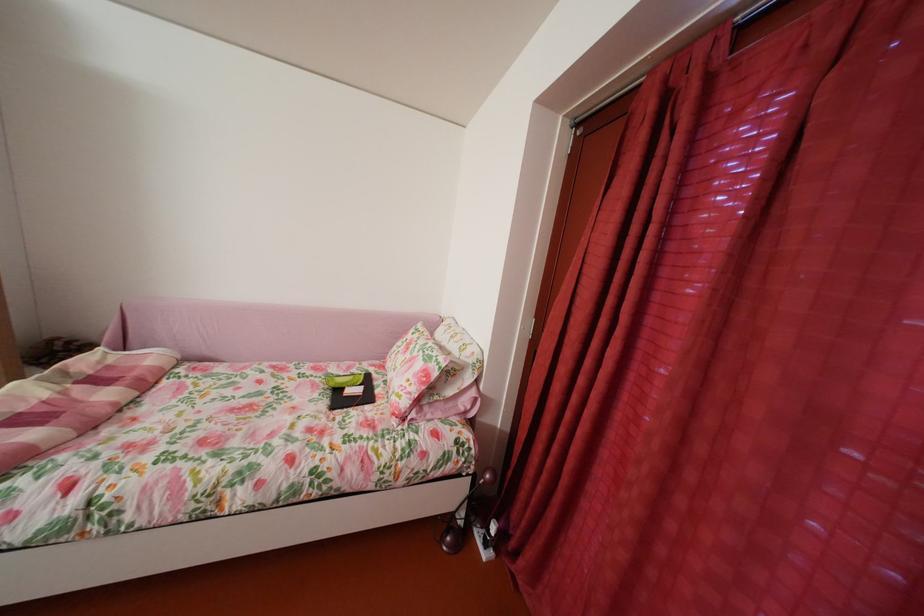
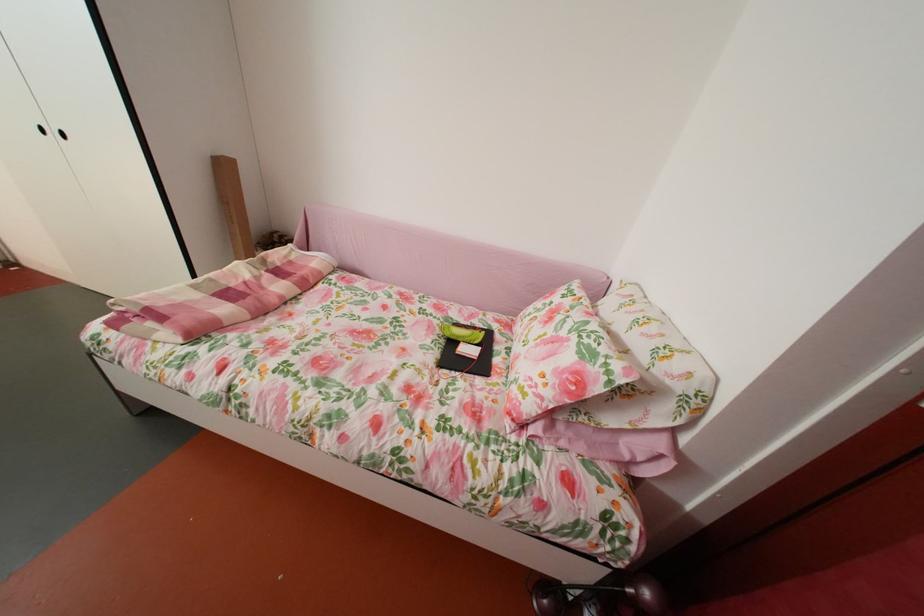
Where in the second image is the point corresponding to [354,379] from the first image?

(473, 328)